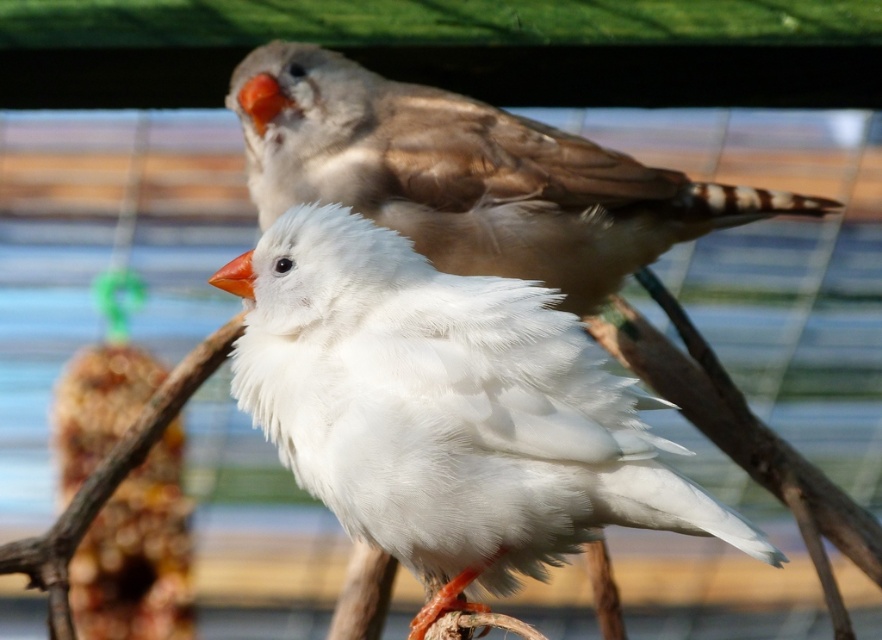
Is white feathered bird at center smaller than matte brown bird at upper center?

Yes, white feathered bird at center is smaller than matte brown bird at upper center.

Is white feathered bird at center bigger than matte brown bird at upper center?

No, white feathered bird at center is not bigger than matte brown bird at upper center.

Measure the distance between point [310,374] and camera.

Point [310,374] is 2.18 meters from camera.

Identify the location of white feathered bird at center. (447, 410).